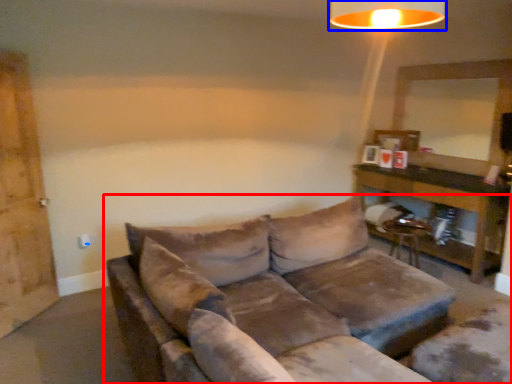
Question: Which point is further to the camera, studio couch (highlighted by a red box) or lamp (highlighted by a blue box)?

Choices:
 (A) studio couch
 (B) lamp

Answer: (B)